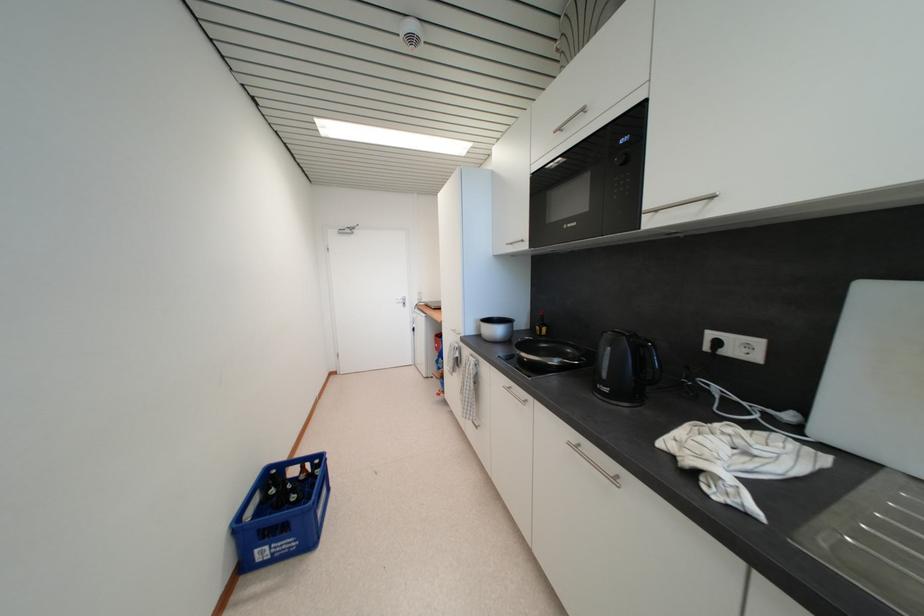
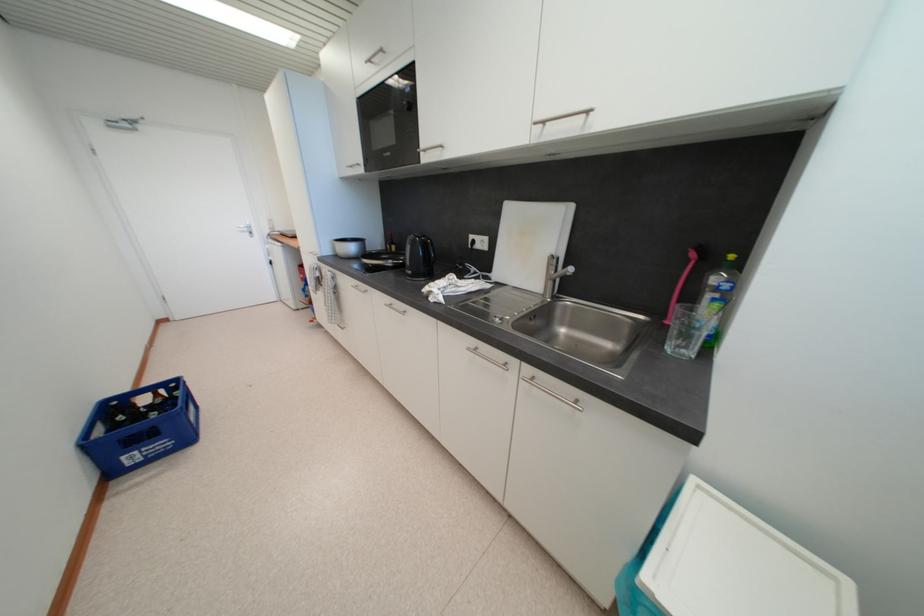
In the second image, find the point that corresponds to [405,305] in the first image.

(248, 235)